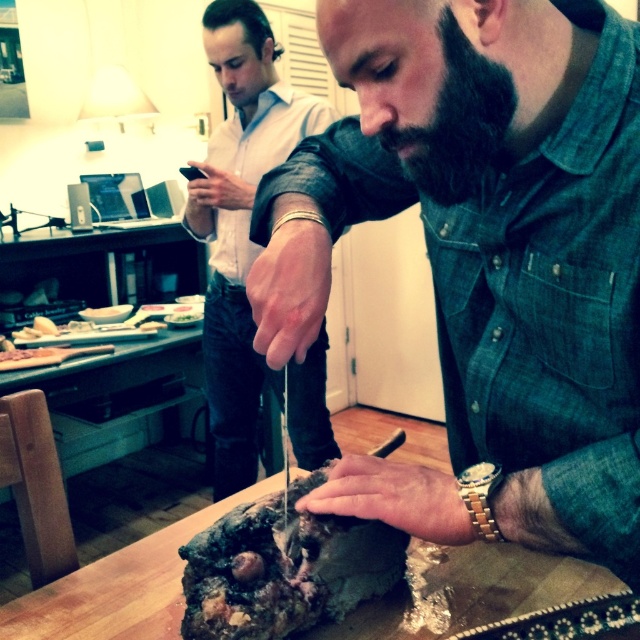
Question: Which object is closer to the camera taking this photo?

Choices:
 (A) wooden cutting board at center
 (B) dark brown crumbly cake at center
 (C) matte black knife at center

Answer: (B)

Question: Is bearded man at center behind black fuzzy beard at center?

Choices:
 (A) no
 (B) yes

Answer: (A)

Question: Is the position of matte black knife at center less distant than that of wooden cutting board at center?

Choices:
 (A) no
 (B) yes

Answer: (A)

Question: Does dark brown crumbly cake at center appear on the left side of black fuzzy beard at center?

Choices:
 (A) yes
 (B) no

Answer: (A)

Question: Which point appears closest to the camera in this image?

Choices:
 (A) (212, 301)
 (B) (390, 125)
 (C) (492, 262)

Answer: (B)

Question: Which point is farther to the camera?

Choices:
 (A) wooden cutting board at center
 (B) bearded man at center

Answer: (A)